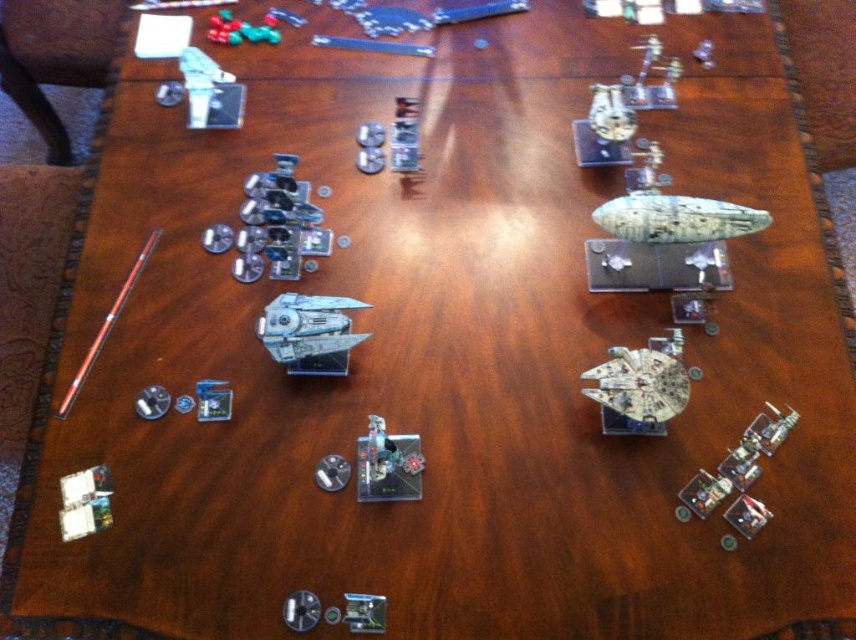
Which is above, metallic silver spaceship at upper left or metallic silver spaceship at center?

Positioned higher is metallic silver spaceship at upper left.

Image resolution: width=856 pixels, height=640 pixels. Describe the element at coordinates (272, 225) in the screenshot. I see `metallic silver spaceship at upper left` at that location.

Who is more forward, (287, 196) or (364, 451)?

Point (364, 451)

At what (x,y) coordinates should I click in order to perform the action: click on metallic silver spaceship at upper left. Please return your answer as a coordinate pair (x, y). The image size is (856, 640). Looking at the image, I should click on (272, 225).

Between white plastic spaceship at center and blue plastic card at center-left, which one has more height?

white plastic spaceship at center

Between white plastic spaceship at center and blue plastic card at center-left, which one is positioned lower?

blue plastic card at center-left

Image resolution: width=856 pixels, height=640 pixels. Describe the element at coordinates (308, 332) in the screenshot. I see `white plastic spaceship at center` at that location.

Where is `white plastic spaceship at center`? white plastic spaceship at center is located at coordinates (308, 332).

Does metallic silver spaceship at center appear over blue plastic card at center-left?

No.

Who is taller, metallic silver spaceship at center or blue plastic card at center-left?

With more height is metallic silver spaceship at center.

Is point (375, 454) in front of point (201, 390)?

Yes, point (375, 454) is closer to viewer.

This screenshot has height=640, width=856. I want to click on metallic silver spaceship at center, so click(387, 465).